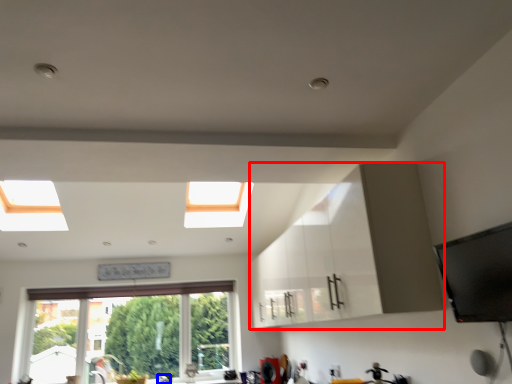
Question: Which point is further to the camera, cabinetry (highlighted by a red box) or faucet (highlighted by a blue box)?

Choices:
 (A) cabinetry
 (B) faucet

Answer: (B)